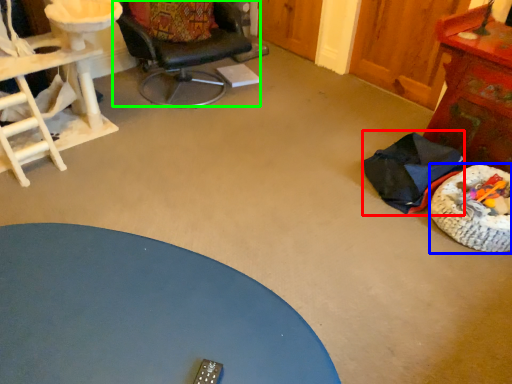
Question: Which is nearer to the chair (highlighted by a red box)? dog bed (highlighted by a blue box) or chair (highlighted by a green box).

Choices:
 (A) dog bed
 (B) chair

Answer: (A)